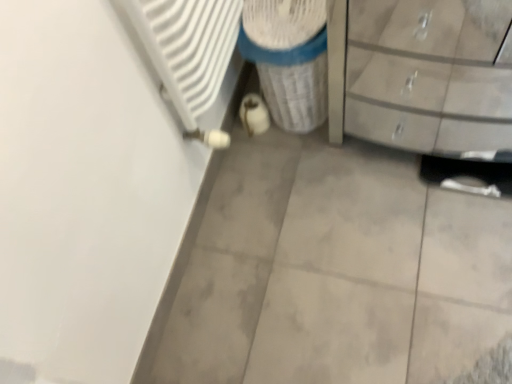
Question: From the image's perspective, would you say matte gray chest of drawers at right is shown under white textured cylinder at center?

Choices:
 (A) yes
 (B) no

Answer: (A)

Question: Does matte gray chest of drawers at right have a smaller size compared to white textured cylinder at center?

Choices:
 (A) yes
 (B) no

Answer: (B)

Question: Does matte gray chest of drawers at right appear on the left side of white textured cylinder at center?

Choices:
 (A) no
 (B) yes

Answer: (A)

Question: From the image's perspective, is matte gray chest of drawers at right over white textured cylinder at center?

Choices:
 (A) no
 (B) yes

Answer: (A)

Question: Is matte gray chest of drawers at right thinner than white textured cylinder at center?

Choices:
 (A) no
 (B) yes

Answer: (A)

Question: Is matte gray chest of drawers at right oriented away from white textured cylinder at center?

Choices:
 (A) yes
 (B) no

Answer: (B)

Question: Can you confirm if white textured cylinder at center is positioned to the left of matte gray chest of drawers at right?

Choices:
 (A) no
 (B) yes

Answer: (B)

Question: Are white textured cylinder at center and matte gray chest of drawers at right located far from each other?

Choices:
 (A) no
 (B) yes

Answer: (A)

Question: Is matte gray chest of drawers at right surrounded by white textured cylinder at center?

Choices:
 (A) no
 (B) yes

Answer: (A)

Question: Does white textured cylinder at center have a lesser height compared to matte gray chest of drawers at right?

Choices:
 (A) no
 (B) yes

Answer: (B)

Question: From a real-world perspective, is white textured cylinder at center physically above matte gray chest of drawers at right?

Choices:
 (A) yes
 (B) no

Answer: (B)

Question: Is white textured cylinder at center taller than matte gray chest of drawers at right?

Choices:
 (A) no
 (B) yes

Answer: (A)

Question: Is matte gray chest of drawers at right in front of or behind white textured cylinder at center in the image?

Choices:
 (A) behind
 (B) front

Answer: (B)